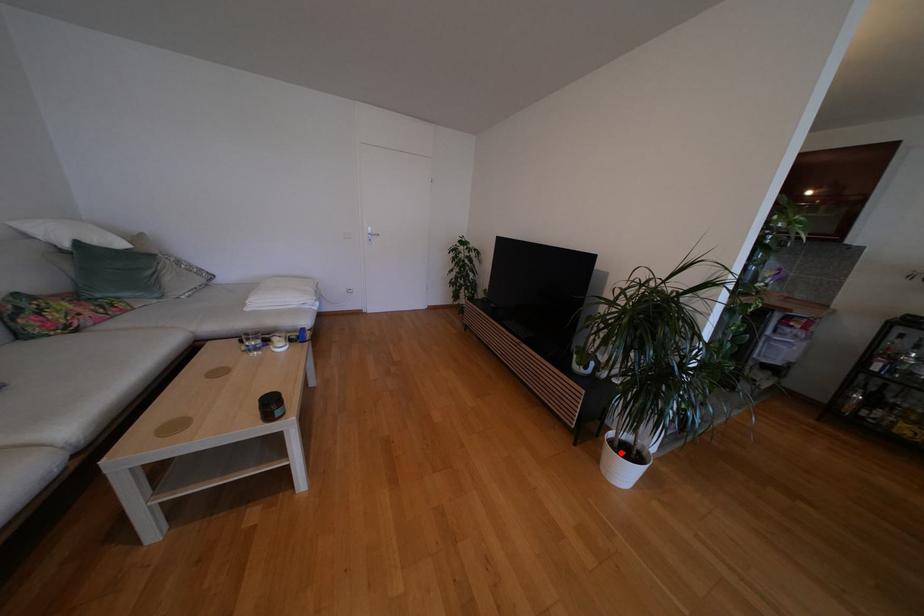
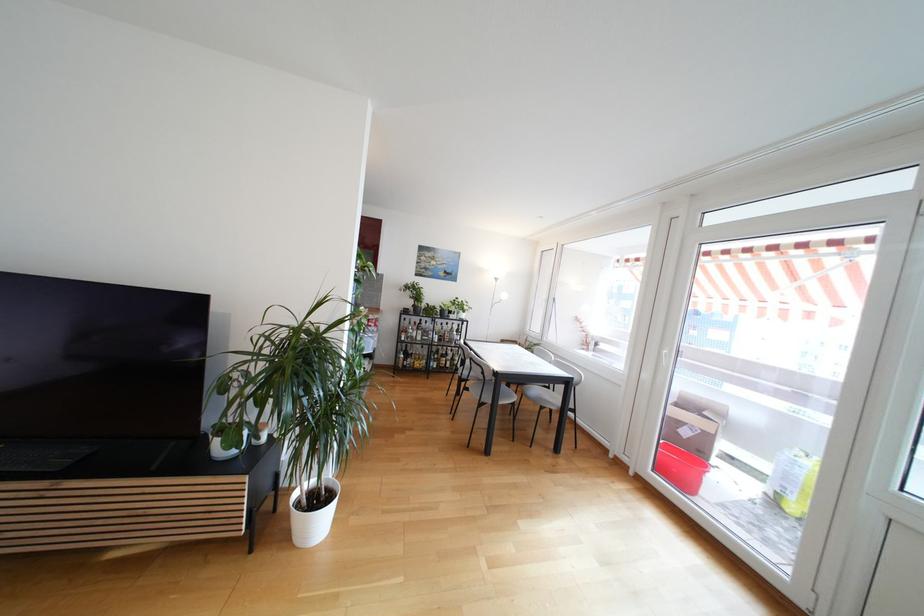
Question: I am providing you with two images of the same scene from different viewpoints. Image1 has a red point marked. In image2, the corresponding 3D location appears at what relative position? Reply with the corresponding letter.

Choices:
 (A) Closer
 (B) Farther

Answer: (B)